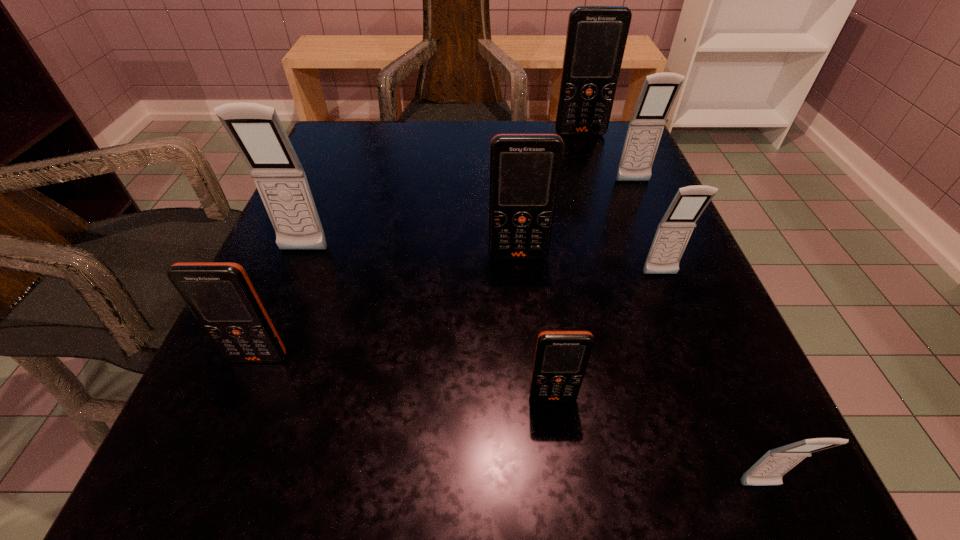
Where is `the farthest orange cellular telephone`? This screenshot has height=540, width=960. the farthest orange cellular telephone is located at coordinates (596, 38).

Where is `the farthest cellular telephone`? The image size is (960, 540). the farthest cellular telephone is located at coordinates (596, 38).

Where is `the leftmost gray cellular telephone`? The height and width of the screenshot is (540, 960). the leftmost gray cellular telephone is located at coordinates (256, 130).

Find the location of `the second farthest gray cellular telephone`. the second farthest gray cellular telephone is located at coordinates (256, 130).

Find the location of a particular element. the farthest gray cellular telephone is located at coordinates click(x=659, y=90).

Locate an element on the screen. Image resolution: width=960 pixels, height=540 pixels. the seventh nearest cellular telephone is located at coordinates (659, 90).

Locate an element on the screen. the third nearest orange cellular telephone is located at coordinates (525, 169).

The height and width of the screenshot is (540, 960). I want to click on the second nearest gray cellular telephone, so click(673, 233).

Locate an element on the screen. the fifth farthest object is located at coordinates (673, 233).

Where is `the sixth farthest object`? The width and height of the screenshot is (960, 540). the sixth farthest object is located at coordinates (220, 295).